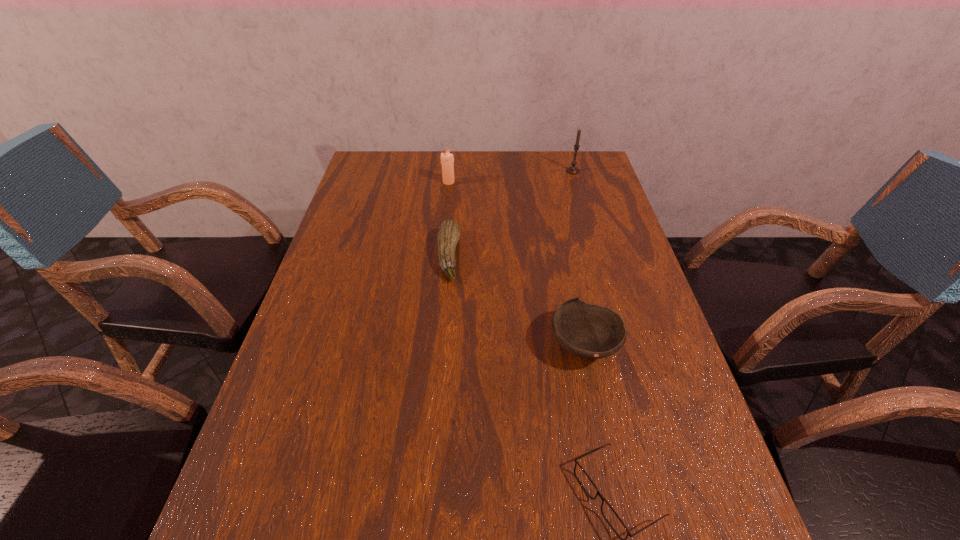
Locate an element on the screen. This screenshot has width=960, height=540. free location located 0.300m on the back of the second nearest object is located at coordinates (562, 239).

You are a GUI agent. You are given a task and a screenshot of the screen. Output one action in this format:
    pyautogui.click(x=<x>, y=<y>)
    Task: Click on the vacant space located 0.080m at the stem end of the third farthest object
    The width and height of the screenshot is (960, 540).
    Given the screenshot: What is the action you would take?
    pyautogui.click(x=490, y=256)

Find the location of a particular element. The image size is (960, 540). candle that is at the right edge is located at coordinates (571, 170).

Where is `bowl positioned at the right edge`? bowl positioned at the right edge is located at coordinates (589, 331).

Locate an element on the screen. object that is at the far right corner is located at coordinates (571, 170).

In the image, there is a desktop. Where is `free space at the far edge`? This screenshot has width=960, height=540. free space at the far edge is located at coordinates (511, 152).

In the image, there is a desktop. Where is `vacant space at the left edge`? vacant space at the left edge is located at coordinates (314, 336).

In the image, there is a desktop. At what (x,y) coordinates should I click in order to perform the action: click on free space at the right edge. Please return your answer as a coordinate pair (x, y). Looking at the image, I should click on (599, 244).

Where is `blank space at the far left corner`? blank space at the far left corner is located at coordinates (372, 186).

This screenshot has width=960, height=540. I want to click on free space at the far right corner of the desktop, so click(x=598, y=181).